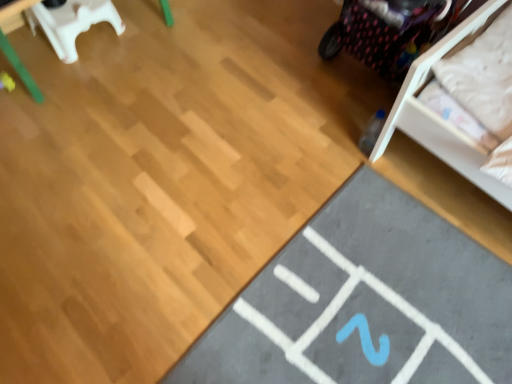
Question: From a real-world perspective, is gray rubber yoga mat at lower right beneath white plastic chair at upper left?

Choices:
 (A) no
 (B) yes

Answer: (B)

Question: Does gray rubber yoga mat at lower right have a lesser height compared to white plastic chair at upper left?

Choices:
 (A) yes
 (B) no

Answer: (A)

Question: From a real-world perspective, is gray rubber yoga mat at lower right on white plastic chair at upper left?

Choices:
 (A) yes
 (B) no

Answer: (B)

Question: Is gray rubber yoga mat at lower right bigger than white plastic chair at upper left?

Choices:
 (A) yes
 (B) no

Answer: (A)

Question: Is white plastic chair at upper left located within gray rubber yoga mat at lower right?

Choices:
 (A) no
 (B) yes

Answer: (A)

Question: Is gray rubber yoga mat at lower right to the left of white plastic chair at upper left from the viewer's perspective?

Choices:
 (A) yes
 (B) no

Answer: (B)

Question: Does white plastic chair at upper left have a lesser height compared to gray rubber yoga mat at lower right?

Choices:
 (A) no
 (B) yes

Answer: (A)

Question: Considering the relative sizes of white plastic chair at upper left and gray rubber yoga mat at lower right in the image provided, is white plastic chair at upper left wider than gray rubber yoga mat at lower right?

Choices:
 (A) yes
 (B) no

Answer: (B)

Question: Is the position of white plastic chair at upper left less distant than that of gray rubber yoga mat at lower right?

Choices:
 (A) yes
 (B) no

Answer: (B)

Question: Considering the relative sizes of white plastic chair at upper left and gray rubber yoga mat at lower right in the image provided, is white plastic chair at upper left thinner than gray rubber yoga mat at lower right?

Choices:
 (A) no
 (B) yes

Answer: (B)

Question: Is the surface of white plastic chair at upper left in direct contact with gray rubber yoga mat at lower right?

Choices:
 (A) yes
 (B) no

Answer: (B)

Question: Can you confirm if white plastic chair at upper left is bigger than gray rubber yoga mat at lower right?

Choices:
 (A) no
 (B) yes

Answer: (A)

Question: Is white plastic chair at upper left bigger or smaller than gray rubber yoga mat at lower right?

Choices:
 (A) big
 (B) small

Answer: (B)